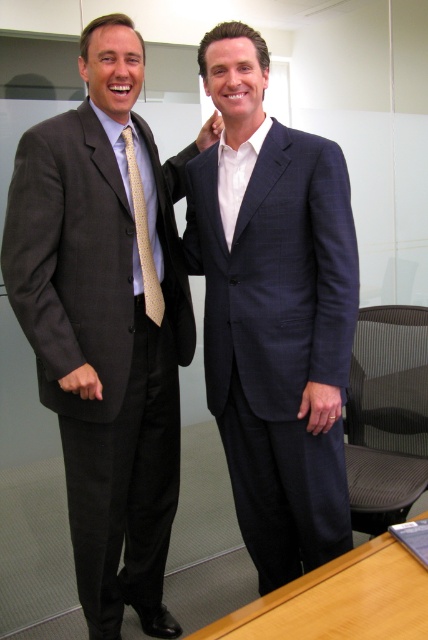
What is the 2D coordinate of the matte black suit at left in the image?

The 2D coordinate of the matte black suit at left is at point (107, 321).